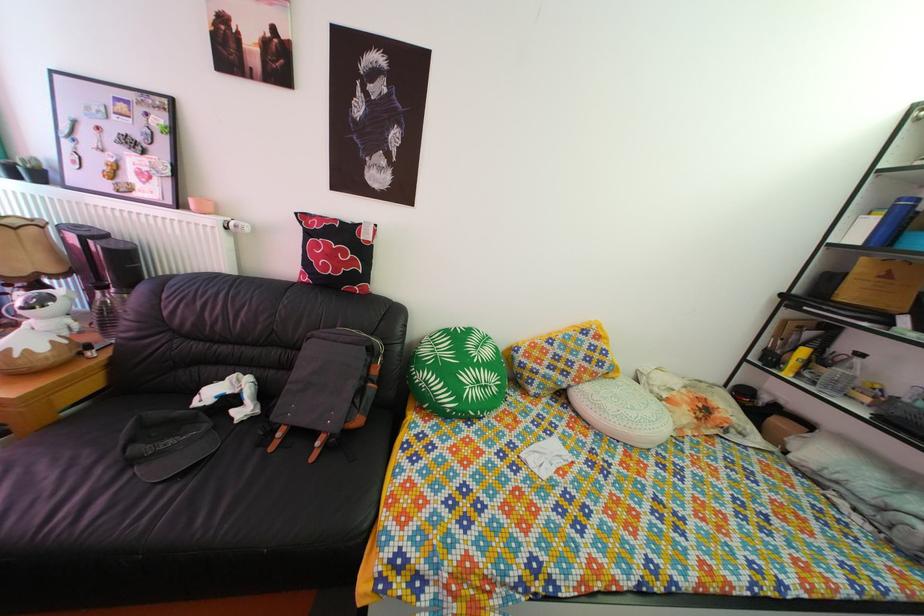
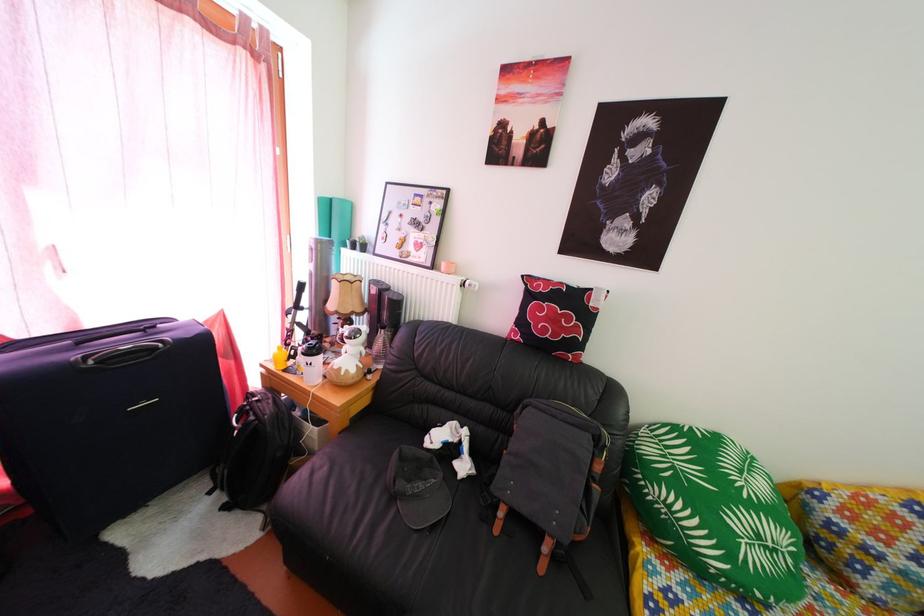
Question: How did the camera likely rotate?

Choices:
 (A) Left
 (B) Right
 (C) Up
 (D) Down

Answer: (A)